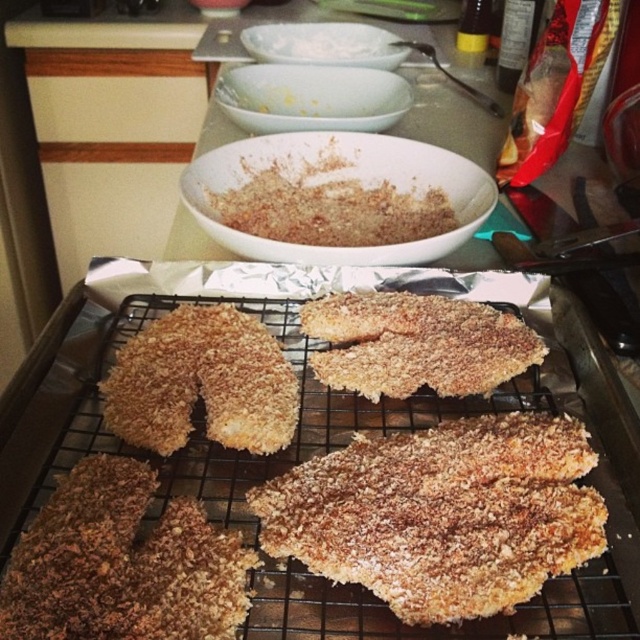
Question: Among these objects, which one is farthest from the camera?

Choices:
 (A) golden-brown crumbly breaded cutlet at center
 (B) golden-brown crumbly breaded chicken at center

Answer: (B)

Question: Can you confirm if golden-brown crumbly breaded chicken at center is bigger than white powder at center?

Choices:
 (A) yes
 (B) no

Answer: (B)

Question: Which point is closer to the camera taking this photo?

Choices:
 (A) (164, 330)
 (B) (488, 426)
 (C) (326, 28)
 (D) (330, 193)

Answer: (B)

Question: Considering the relative positions of golden-brown crumbly breaded cutlet at center and brown crumbly mixture at center in the image provided, where is golden-brown crumbly breaded cutlet at center located with respect to brown crumbly mixture at center?

Choices:
 (A) right
 (B) left

Answer: (A)

Question: Can you confirm if golden-brown crumbly breaded cutlet at center is positioned below white powder at center?

Choices:
 (A) no
 (B) yes

Answer: (B)

Question: Which of these objects is positioned closest to the brown crumbly breaded chicken at center?

Choices:
 (A) white powder at center
 (B) golden-brown crumbly breaded cutlet at center
 (C) golden-brown crumbly breaded chicken at center
 (D) golden-brown crispy chicken at center

Answer: (D)